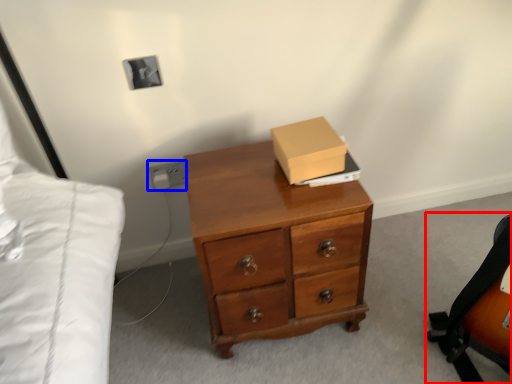
Question: Which point is further to the camera, messenger bag (highlighted by a red box) or electric outlet (highlighted by a blue box)?

Choices:
 (A) messenger bag
 (B) electric outlet

Answer: (B)